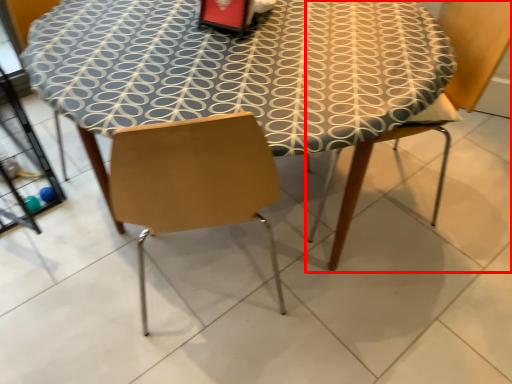
Question: From the image's perspective, considering the relative positions of chair (annotated by the red box) and table in the image provided, where is chair (annotated by the red box) located with respect to the staircase?

Choices:
 (A) above
 (B) below

Answer: (A)